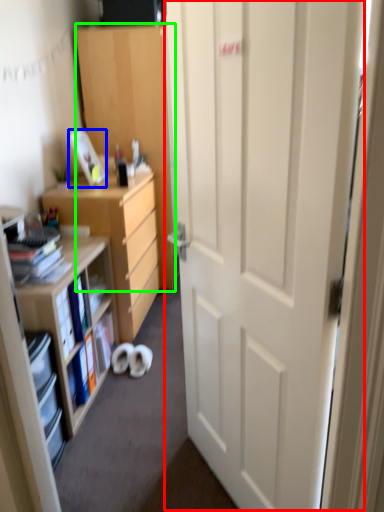
Question: Which object is positioned closest to door (highlighted by a red box)? Select from picture frame (highlighted by a blue box) and cabinetry (highlighted by a green box).

Choices:
 (A) picture frame
 (B) cabinetry

Answer: (A)